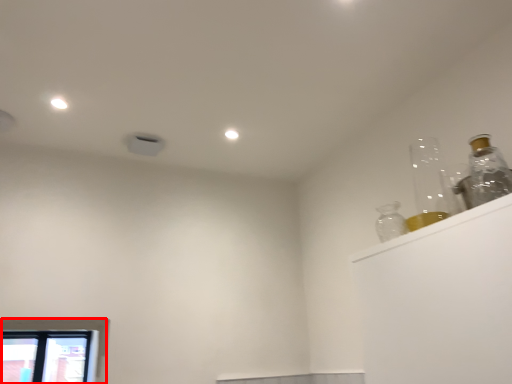
Question: From the image's perspective, considering the relative positions of window (annotated by the red box) and bottle in the image provided, where is window (annotated by the red box) located with respect to the staircase?

Choices:
 (A) above
 (B) below

Answer: (B)